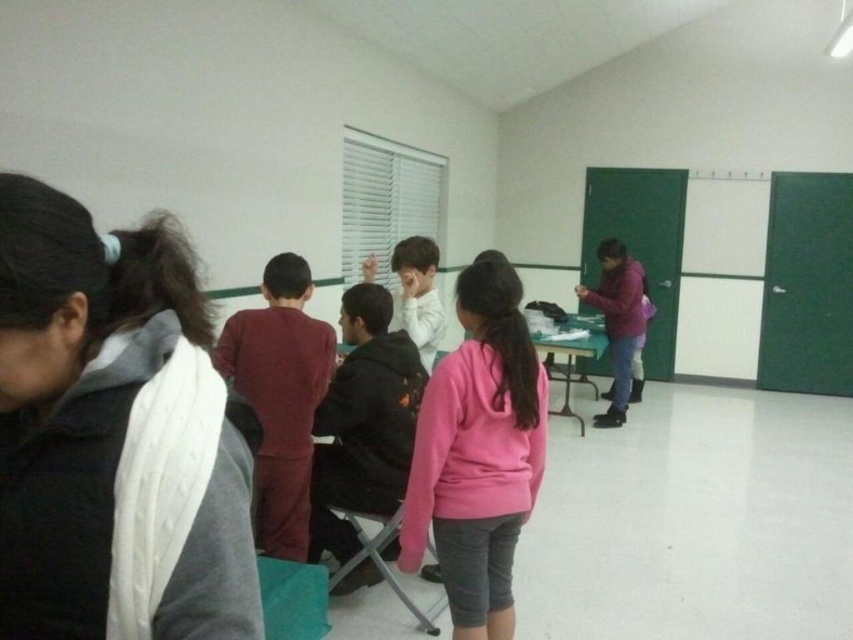
Question: Does pink fleece sweatshirt at center have a smaller size compared to white matte shirt at center?

Choices:
 (A) no
 (B) yes

Answer: (B)

Question: Which point is farther to the camera?

Choices:
 (A) white knitted scarf at left
 (B) purple fleece jacket at right

Answer: (B)

Question: Which point is closer to the camera?

Choices:
 (A) (434, 410)
 (B) (614, 346)
 (C) (100, 481)

Answer: (C)

Question: Can you confirm if pink fleece sweatshirt at center is positioned to the right of white matte shirt at center?

Choices:
 (A) yes
 (B) no

Answer: (A)

Question: Based on their relative distances, which object is nearer to the white matte shirt at center?

Choices:
 (A) purple fleece jacket at right
 (B) pink fleece sweatshirt at center
 (C) white knitted scarf at left

Answer: (B)

Question: Can you confirm if pink fleece sweatshirt at center is positioned to the right of white matte shirt at center?

Choices:
 (A) yes
 (B) no

Answer: (A)